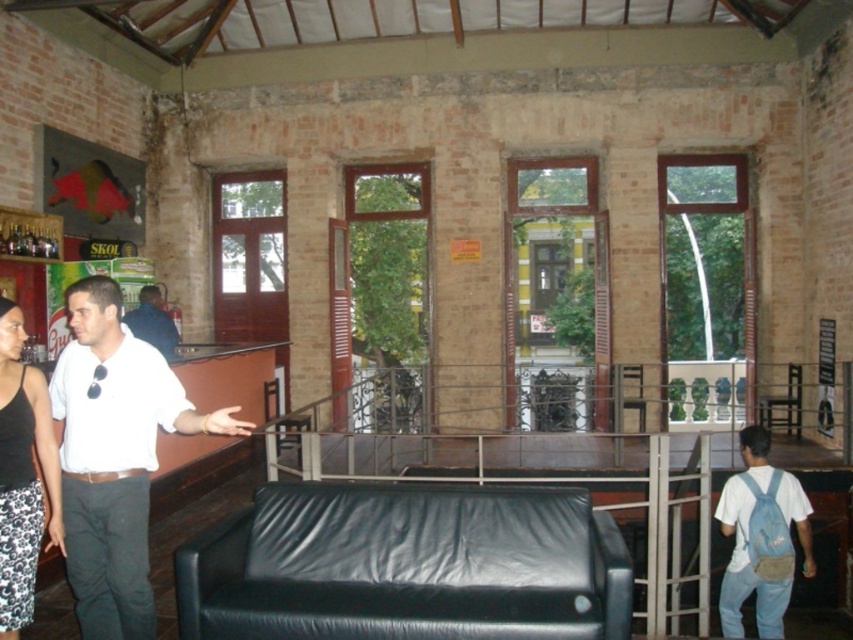
Question: Which is farther from the black textured tank top at left?

Choices:
 (A) white shirt at left
 (B) dark blue shirt at left

Answer: (B)

Question: Is the position of denim backpack at lower right more distant than that of dark blue shirt at left?

Choices:
 (A) no
 (B) yes

Answer: (A)

Question: Which object is farther from the camera taking this photo?

Choices:
 (A) denim backpack at lower right
 (B) black textured tank top at left

Answer: (A)

Question: Can you confirm if white shirt at left is positioned above black textured tank top at left?

Choices:
 (A) no
 (B) yes

Answer: (A)

Question: Is white shirt at left below denim backpack at lower right?

Choices:
 (A) no
 (B) yes

Answer: (A)

Question: Which object is positioned closest to the denim backpack at lower right?

Choices:
 (A) black textured tank top at left
 (B) dark blue shirt at left

Answer: (A)